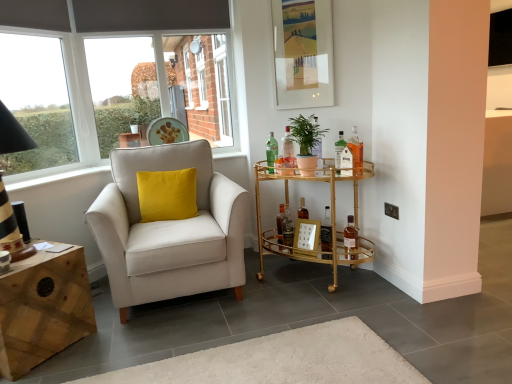
Question: Which direction should I rotate to face translucent glass bottle at center, which ranks as the 6th bottle in right-to-left order, — up or down?

Choices:
 (A) down
 (B) up

Answer: (A)

Question: Is translucent glass bottle at upper right, which ranks as the second bottle in right-to-left order, facing towards matte glass picture frame at upper center?

Choices:
 (A) no
 (B) yes

Answer: (A)

Question: Can we say translucent glass bottle at upper right, which appears as the 7th bottle when viewed from the left, lies outside matte glass picture frame at upper center?

Choices:
 (A) yes
 (B) no

Answer: (A)

Question: Does translucent glass bottle at upper right, which ranks as the second bottle in right-to-left order, appear on the right side of matte glass picture frame at upper center?

Choices:
 (A) yes
 (B) no

Answer: (A)

Question: Is translucent glass bottle at upper right, which appears as the 7th bottle when viewed from the left, facing away from matte glass picture frame at upper center?

Choices:
 (A) no
 (B) yes

Answer: (A)

Question: Is there a large distance between translucent glass bottle at upper right, which ranks as the second bottle in right-to-left order, and matte glass picture frame at upper center?

Choices:
 (A) yes
 (B) no

Answer: (B)

Question: From the image's perspective, does translucent glass bottle at upper right, which ranks as the second bottle in right-to-left order, appear lower than matte glass picture frame at upper center?

Choices:
 (A) no
 (B) yes

Answer: (B)

Question: Considering the relative sizes of matte glass picture frame at upper center and natural wood desk at lower left in the image provided, is matte glass picture frame at upper center shorter than natural wood desk at lower left?

Choices:
 (A) yes
 (B) no

Answer: (B)

Question: Considering the relative sizes of matte glass picture frame at upper center and natural wood desk at lower left in the image provided, is matte glass picture frame at upper center taller than natural wood desk at lower left?

Choices:
 (A) yes
 (B) no

Answer: (A)

Question: From the image's perspective, does matte glass picture frame at upper center appear lower than natural wood desk at lower left?

Choices:
 (A) yes
 (B) no

Answer: (B)

Question: From the image's perspective, is matte glass picture frame at upper center over natural wood desk at lower left?

Choices:
 (A) yes
 (B) no

Answer: (A)

Question: Is matte glass picture frame at upper center outside of natural wood desk at lower left?

Choices:
 (A) yes
 (B) no

Answer: (A)

Question: Is the depth of matte glass picture frame at upper center greater than that of natural wood desk at lower left?

Choices:
 (A) no
 (B) yes

Answer: (B)

Question: Does gold mirrored bar cart at center right have a lesser width compared to matte white armchair at left?

Choices:
 (A) yes
 (B) no

Answer: (A)